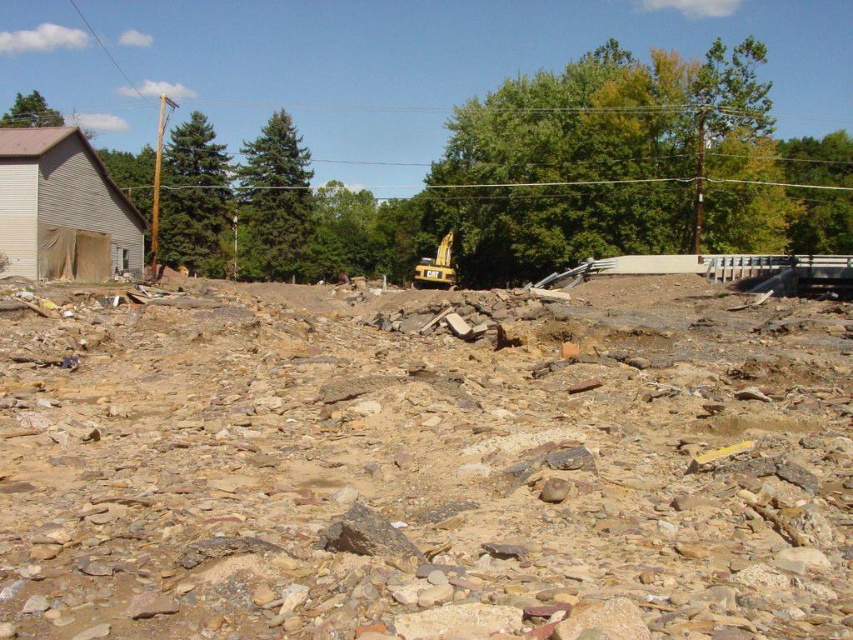
Is brown rocky debris at center taller than yellow metallic excavator at center?

In fact, brown rocky debris at center may be shorter than yellow metallic excavator at center.

Is brown rocky debris at center thinner than yellow metallic excavator at center?

Incorrect, brown rocky debris at center's width is not less than yellow metallic excavator at center's.

Which is in front, point (651, 413) or point (428, 275)?

Positioned in front is point (651, 413).

This screenshot has width=853, height=640. I want to click on brown rocky debris at center, so click(424, 467).